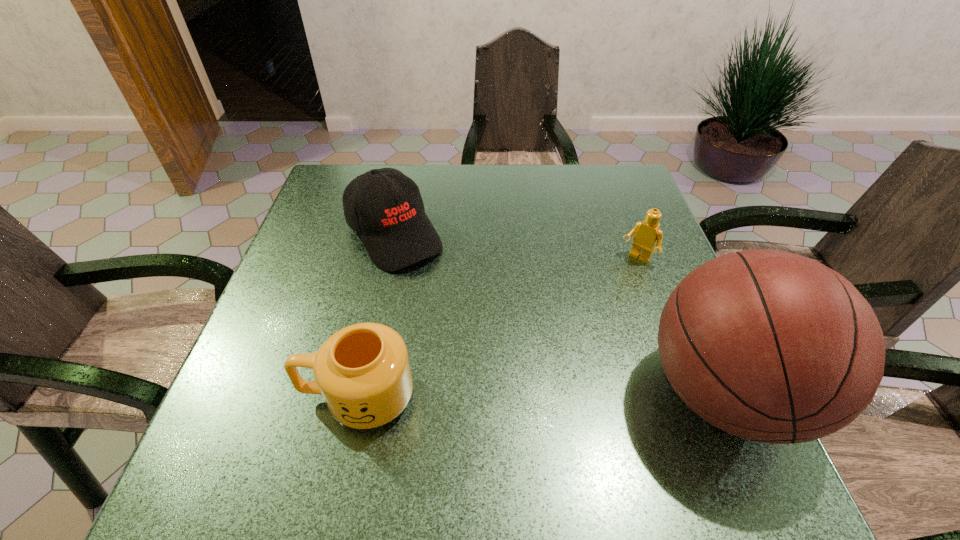
Identify the location of free spot on the desktop that is between the mug and the basketball and is positioned on the face of the Lego. (532, 395).

Identify the location of vacant space on the desktop that is between the mug and the tallest object and is positioned on the front-facing side of the baseball cap. This screenshot has width=960, height=540. (525, 395).